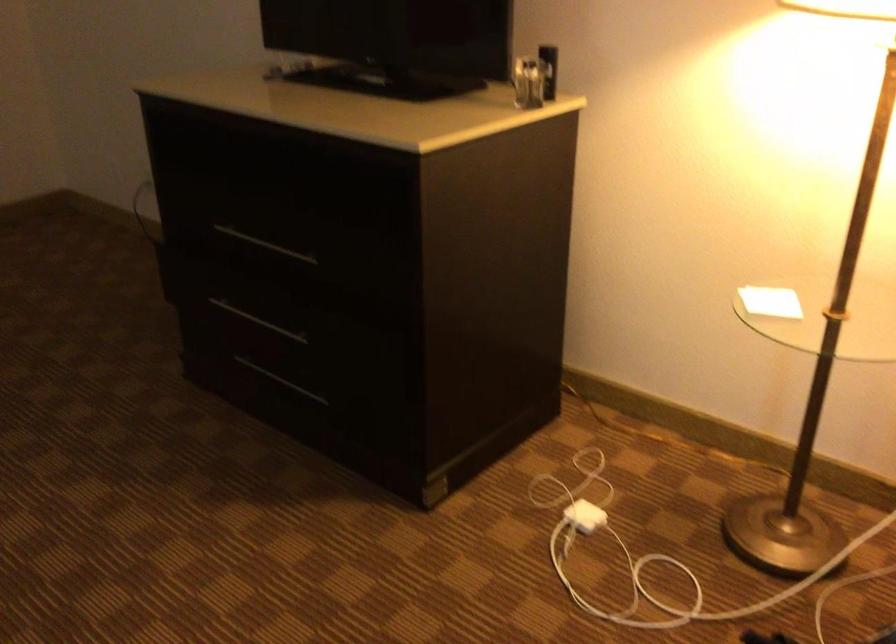
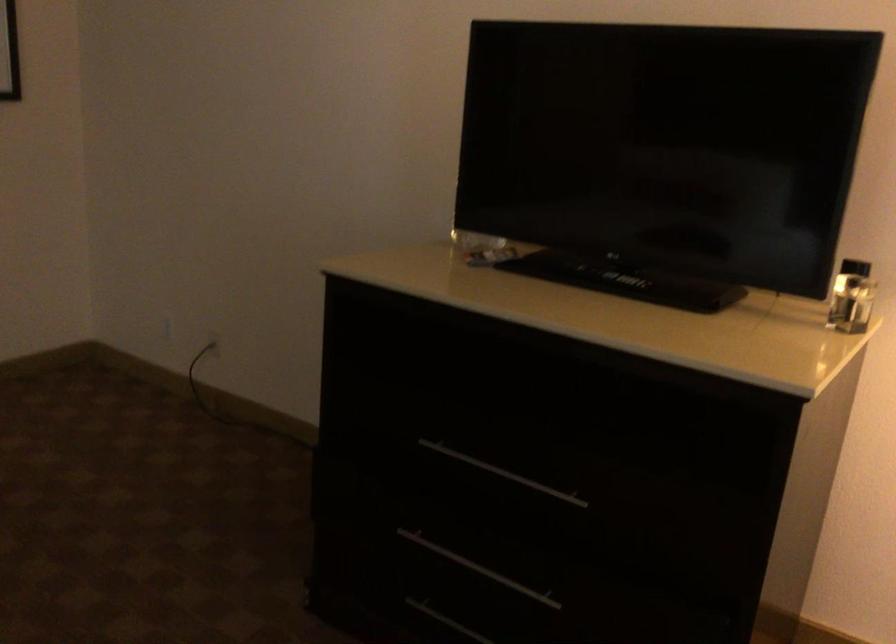
Question: The first image is from the beginning of the video and the second image is from the end. How did the camera likely rotate when shooting the video?

Choices:
 (A) Left
 (B) Right
 (C) Up
 (D) Down

Answer: (C)